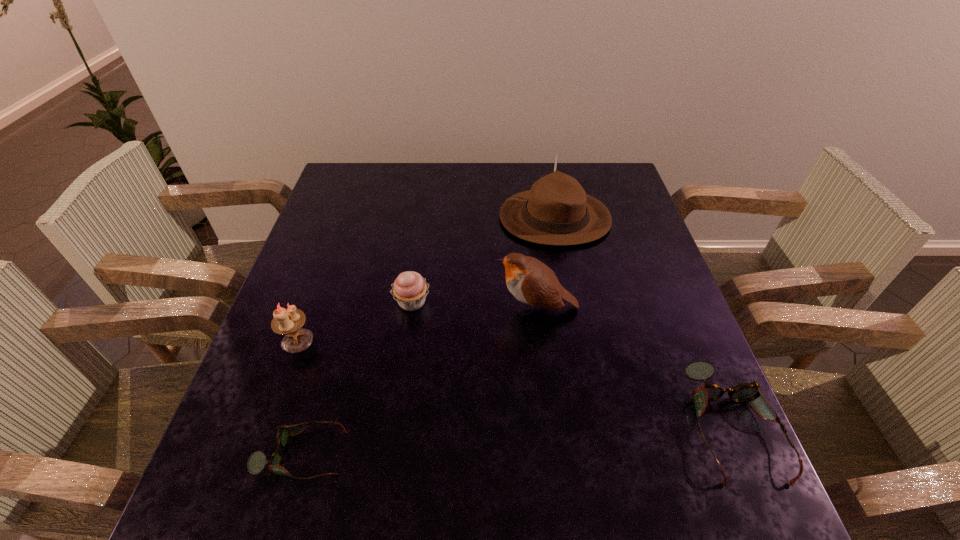
Where is `vacant space situated 0.340m on the feather side of the farthest object`? The height and width of the screenshot is (540, 960). vacant space situated 0.340m on the feather side of the farthest object is located at coordinates (381, 218).

Identify the location of vacant space located 0.320m on the feather side of the farthest object. (388, 218).

Identify the location of vacant space located on the feather side of the farthest object. [x=471, y=218].

Identify the location of free space located on the back of the third nearest object. (337, 232).

Identify the location of vacant space located 0.150m on the back of the fourth tallest object. (420, 247).

Where is `vacant region located 0.310m at the face of the bird`? vacant region located 0.310m at the face of the bird is located at coordinates (362, 308).

Where is `blank space located 0.110m at the face of the bird`? The height and width of the screenshot is (540, 960). blank space located 0.110m at the face of the bird is located at coordinates (447, 308).

Identify the location of vacant space situated 0.250m at the face of the bird. (388, 308).

The width and height of the screenshot is (960, 540). What are the coordinates of `object that is at the far edge` in the screenshot? It's located at (556, 211).

Image resolution: width=960 pixels, height=540 pixels. I want to click on spectacles that is at the left edge, so click(257, 461).